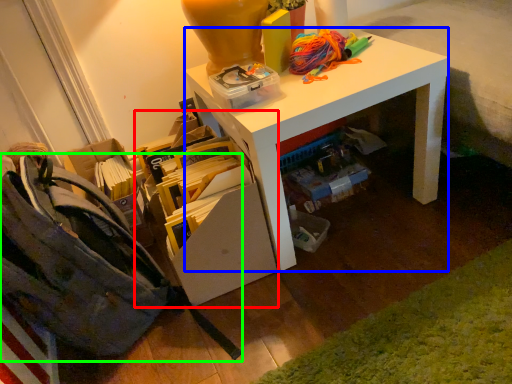
Question: Considering the real-world distances, which object is farthest from shelf (highlighted by a red box)? desk (highlighted by a blue box) or shoulder bag (highlighted by a green box)?

Choices:
 (A) desk
 (B) shoulder bag

Answer: (B)